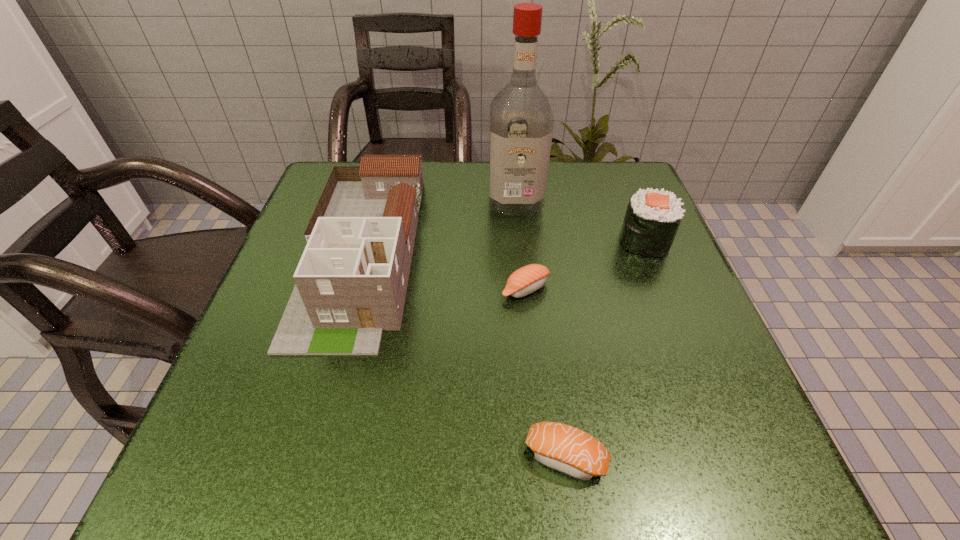
Identify the location of free space between the liquor and the rightmost object. [580, 221].

At what (x,y) coordinates should I click in order to perform the action: click on empty space between the nearest object and the farthest sushi. Please return your answer as a coordinate pair (x, y). The image size is (960, 540). Looking at the image, I should click on (605, 349).

This screenshot has height=540, width=960. In order to click on vacant region between the tallest sushi and the nearest sushi in this screenshot , I will do tap(605, 349).

Where is `empty space between the dollhouse and the nearest sushi`? This screenshot has height=540, width=960. empty space between the dollhouse and the nearest sushi is located at coordinates (464, 354).

Point out which object is positioned as the fourth nearest to the tallest sushi. Please provide its 2D coordinates. Your answer should be formatted as a tuple, i.e. [(x, y)], where the tuple contains the x and y coordinates of a point satisfying the conditions above.

[(351, 281)]

Identify which object is located as the nearest to the third shortest object. Please provide its 2D coordinates. Your answer should be formatted as a tuple, i.e. [(x, y)], where the tuple contains the x and y coordinates of a point satisfying the conditions above.

[(521, 121)]

The height and width of the screenshot is (540, 960). I want to click on the third closest sushi to the tallest object, so click(564, 448).

Select which sushi appears as the closest to the second nearest sushi. Please provide its 2D coordinates. Your answer should be formatted as a tuple, i.e. [(x, y)], where the tuple contains the x and y coordinates of a point satisfying the conditions above.

[(652, 219)]

This screenshot has width=960, height=540. I want to click on free space that satisfies the following two spatial constraints: 1. on the front-facing side of the nearest sushi; 2. on the right side of the tallest object, so click(x=540, y=457).

The image size is (960, 540). I want to click on vacant area in the image that satisfies the following two spatial constraints: 1. at the main entrance of the leftmost object; 2. on the left side of the nearest sushi, so click(304, 457).